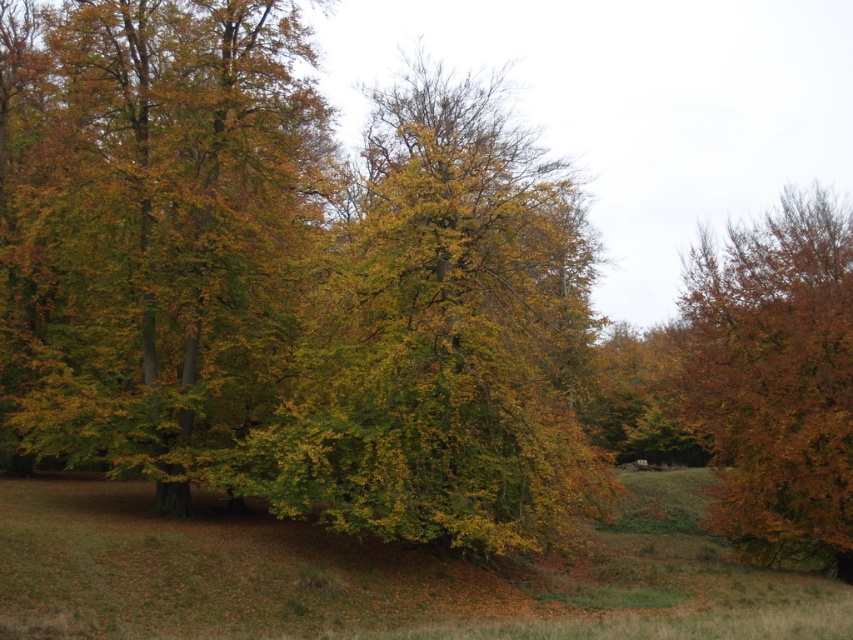
Question: Does golden-green leaves at center have a smaller size compared to brown matte tree at right?

Choices:
 (A) no
 (B) yes

Answer: (B)

Question: Can you confirm if golden-green leaves at center is wider than brown matte tree at right?

Choices:
 (A) yes
 (B) no

Answer: (A)

Question: Which object is positioned closest to the green leafy tree at center?

Choices:
 (A) golden-green leaves at center
 (B) brown matte tree at right

Answer: (A)

Question: Based on their relative distances, which object is farther from the green leafy tree at center?

Choices:
 (A) golden-green leaves at center
 (B) brown matte tree at right

Answer: (B)

Question: Where is golden-green leaves at center located in relation to green leafy tree at center in the image?

Choices:
 (A) left
 (B) right

Answer: (A)

Question: Which point appears closest to the camera in this image?

Choices:
 (A) coord(479,273)
 (B) coord(828,483)

Answer: (A)